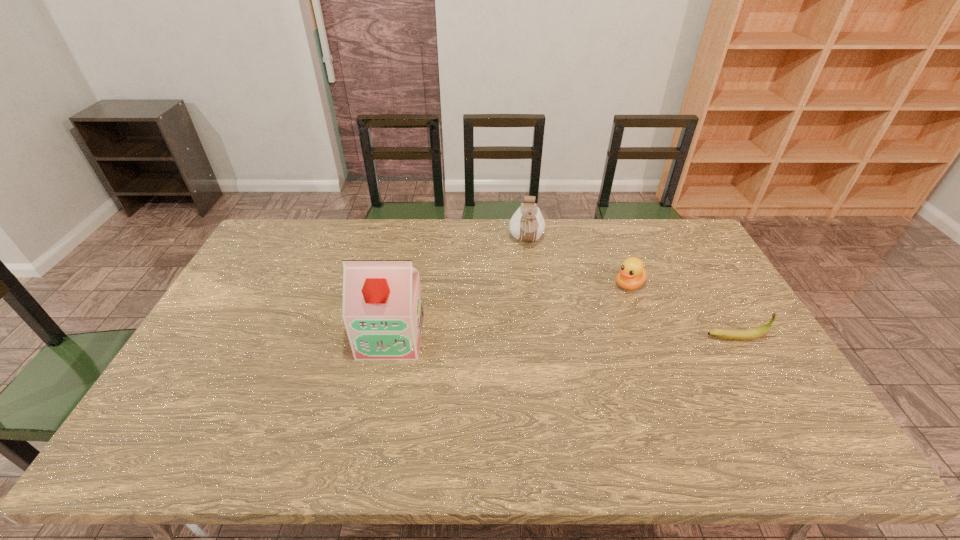
The width and height of the screenshot is (960, 540). What are the coordinates of `free space on the desktop that is between the leftmost object and the rightmost object and is positioned on the face of the duckling` in the screenshot? It's located at (559, 337).

This screenshot has width=960, height=540. Identify the location of free spot on the desktop that is between the leftmost object and the rightmost object and is positioned on the front-facing side of the second tallest object. (534, 337).